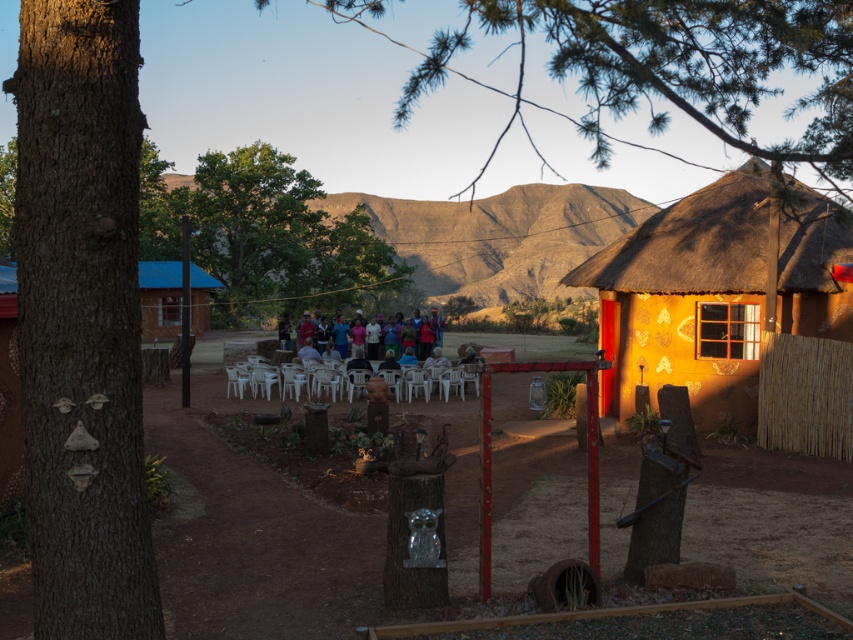
Question: Which of these objects is positioned closest to the matte orange thatched hut at right?

Choices:
 (A) brown rough bark tree at left
 (B) brown dirt field at center
 (C) green rough bark tree at left

Answer: (B)

Question: Among these objects, which one is farthest from the camera?

Choices:
 (A) white plastic chairs at center
 (B) brown dirt field at center
 (C) multicolored fabric group at center

Answer: (C)

Question: Considering the real-world distances, which object is closest to the rugged brown mountain at center?

Choices:
 (A) brown dirt field at center
 (B) multicolored fabric group at center
 (C) brown rough bark tree at left

Answer: (B)

Question: From the image, what is the correct spatial relationship of brown dirt field at center in relation to green leafy tree at center?

Choices:
 (A) left
 (B) right

Answer: (B)

Question: Observing the image, what is the correct spatial positioning of rugged brown mountain at center in reference to white plastic chairs at center?

Choices:
 (A) right
 (B) left

Answer: (B)

Question: Considering the relative positions of brown rough bark tree at left and multicolored fabric group at center in the image provided, where is brown rough bark tree at left located with respect to multicolored fabric group at center?

Choices:
 (A) below
 (B) above

Answer: (A)